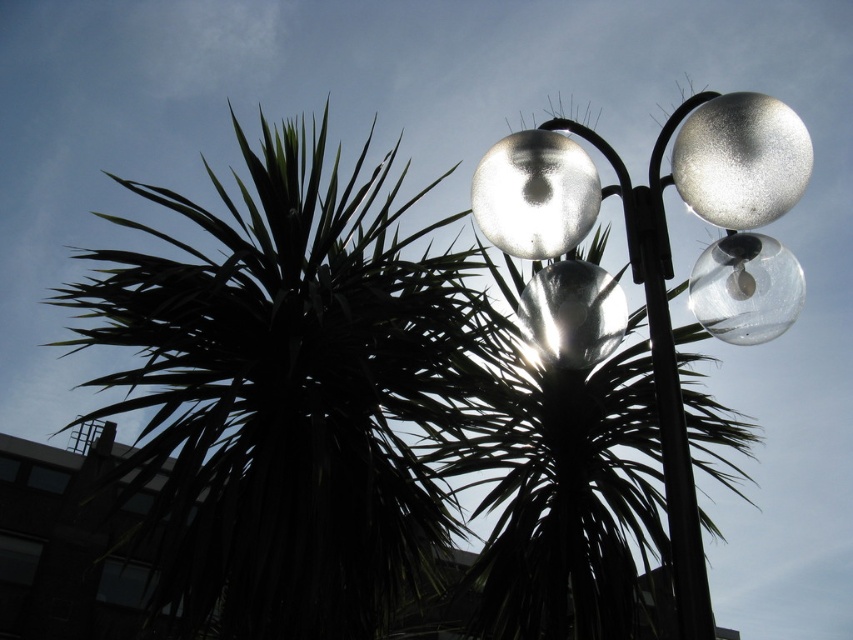
Question: Is satin silver globes at upper right to the right of satin silver lamp at center from the viewer's perspective?

Choices:
 (A) yes
 (B) no

Answer: (A)

Question: Which point is closer to the camera?

Choices:
 (A) glossy glass light at upper center
 (B) metallic silver sphere at upper right
 (C) satin silver lamp at center

Answer: (B)

Question: Which point is closer to the camera?

Choices:
 (A) satin silver globes at upper right
 (B) satin silver lamp at center
 (C) transparent glass globe at right
 (D) metallic silver sphere at upper right

Answer: (A)

Question: Can you confirm if metallic silver sphere at upper right is positioned above satin silver lamp at center?

Choices:
 (A) no
 (B) yes

Answer: (B)

Question: Is the position of transparent glass globe at right less distant than that of satin silver lamp at center?

Choices:
 (A) yes
 (B) no

Answer: (A)

Question: Which point is farther to the camera?

Choices:
 (A) transparent glass globe at right
 (B) satin silver lamp at center

Answer: (B)